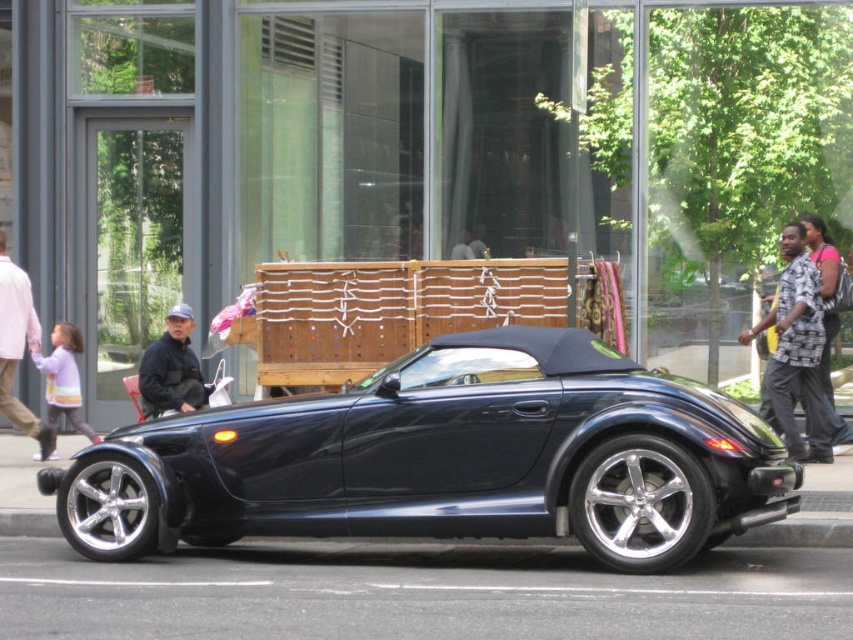
In the scene shown: Does glossy black convertible at center have a greater width compared to light purple sweater at left?

Yes, glossy black convertible at center is wider than light purple sweater at left.

Is point (700, 474) less distant than point (67, 364)?

Yes.

Identify the location of glossy black convertible at center. (445, 460).

Find the location of a particular element. The height and width of the screenshot is (640, 853). printed fabric shirt at right is located at coordinates (796, 352).

Who is positioned more to the right, printed fabric shirt at right or light purple sweater at left?

Positioned to the right is printed fabric shirt at right.

Locate an element on the screen. printed fabric shirt at right is located at coordinates point(796,352).

Identify the location of printed fabric shirt at right. This screenshot has width=853, height=640. (796, 352).

Does glossy black convertible at center have a smaller size compared to light pink shirt at left?

No, glossy black convertible at center is not smaller than light pink shirt at left.

Who is lower down, glossy black convertible at center or light pink shirt at left?

glossy black convertible at center

Is point (521, 460) farther from viewer compared to point (16, 266)?

No, it is in front of (16, 266).

Find the location of a particular element. Image resolution: width=853 pixels, height=640 pixels. glossy black convertible at center is located at coordinates (445, 460).